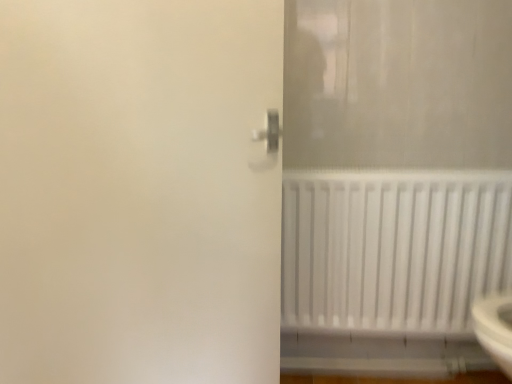
This screenshot has width=512, height=384. What do you see at coordinates (139, 192) in the screenshot?
I see `white matte screen door at center` at bounding box center [139, 192].

Identify the location of white matte screen door at center. Image resolution: width=512 pixels, height=384 pixels. (139, 192).

Identify the location of white matte radiator at lower right. (393, 248).

The image size is (512, 384). Describe the element at coordinates (393, 248) in the screenshot. I see `white matte radiator at lower right` at that location.

Where is `white matte screen door at center`? white matte screen door at center is located at coordinates (139, 192).

In the scene shown: Would you say white matte screen door at center is to the left or to the right of white matte radiator at lower right in the picture?

In the image, white matte screen door at center appears on the left side of white matte radiator at lower right.

Considering the positions of objects white matte screen door at center and white matte radiator at lower right in the image provided, who is behind, white matte screen door at center or white matte radiator at lower right?

white matte radiator at lower right is behind.

Which is closer to the camera, (136, 361) or (355, 240)?

Point (136, 361) is positioned closer to the camera compared to point (355, 240).

From the image's perspective, is white matte screen door at center under white matte radiator at lower right?

No, from the image's perspective, white matte screen door at center is not beneath white matte radiator at lower right.

From a real-world perspective, is white matte screen door at center above or below white matte radiator at lower right?

In terms of real-world spatial position, white matte screen door at center is above white matte radiator at lower right.

Which of these two, white matte screen door at center or white matte radiator at lower right, is wider?

white matte radiator at lower right.

Which of these two, white matte screen door at center or white matte radiator at lower right, stands taller?

With more height is white matte screen door at center.

Which of these two, white matte screen door at center or white matte radiator at lower right, is bigger?

white matte screen door at center is bigger.

Consider the image. Do you think white matte screen door at center is within white matte radiator at lower right, or outside of it?

white matte screen door at center is outside white matte radiator at lower right.

Is white matte screen door at center far away from white matte radiator at lower right?

No, white matte screen door at center is not far away from white matte radiator at lower right.

Is white matte screen door at center oriented towards white matte radiator at lower right?

No, white matte screen door at center is not turned towards white matte radiator at lower right.

What's the angular difference between white matte screen door at center and white matte radiator at lower right's facing directions?

They differ by 44.3 degrees in their facing directions.

How much distance is there between white matte screen door at center and white matte radiator at lower right?

white matte screen door at center is 21.79 inches from white matte radiator at lower right.

In the image, there is a white matte radiator at lower right. Where is `screen door above it (from the image's perspective)`? The width and height of the screenshot is (512, 384). screen door above it (from the image's perspective) is located at coordinates click(x=139, y=192).

Consider the image. Is white matte radiator at lower right to the left of white matte screen door at center from the viewer's perspective?

No, white matte radiator at lower right is not to the left of white matte screen door at center.

Relative to white matte screen door at center, is white matte radiator at lower right in front or behind?

Clearly, white matte radiator at lower right is behind white matte screen door at center.

Which is in front, point (416, 240) or point (47, 309)?

Positioned in front is point (47, 309).

From the image's perspective, is white matte radiator at lower right positioned above or below white matte screen door at center?

Clearly, from the image's perspective, white matte radiator at lower right is below white matte screen door at center.

Consider the image. From a real-world perspective, is white matte radiator at lower right physically above white matte screen door at center?

No, from a real-world perspective, white matte radiator at lower right is not above white matte screen door at center.

Is white matte radiator at lower right wider than white matte screen door at center?

Yes.

Does white matte radiator at lower right have a greater height compared to white matte screen door at center?

No, white matte radiator at lower right is not taller than white matte screen door at center.

Who is smaller, white matte radiator at lower right or white matte screen door at center?

white matte radiator at lower right.

Is white matte radiator at lower right surrounding white matte screen door at center?

No, white matte screen door at center is not inside white matte radiator at lower right.

Are white matte radiator at lower right and white matte screen door at center located far from each other?

No, white matte radiator at lower right is not far away from white matte screen door at center.

From the picture: Does white matte radiator at lower right turn towards white matte screen door at center?

No, white matte radiator at lower right is not oriented towards white matte screen door at center.

You are a GUI agent. You are given a task and a screenshot of the screen. Output one action in this format:
    pyautogui.click(x=<x>, y=<y>)
    Task: Click on the screen door that is above the white matte radiator at lower right (from the image's perspective)
    This screenshot has width=512, height=384.
    Given the screenshot: What is the action you would take?
    [139, 192]

The image size is (512, 384). What are the coordinates of `radiator behind the white matte screen door at center` in the screenshot? It's located at (393, 248).

Image resolution: width=512 pixels, height=384 pixels. What are the coordinates of `screen door above the white matte radiator at lower right (from the image's perspective)` in the screenshot? It's located at (x=139, y=192).